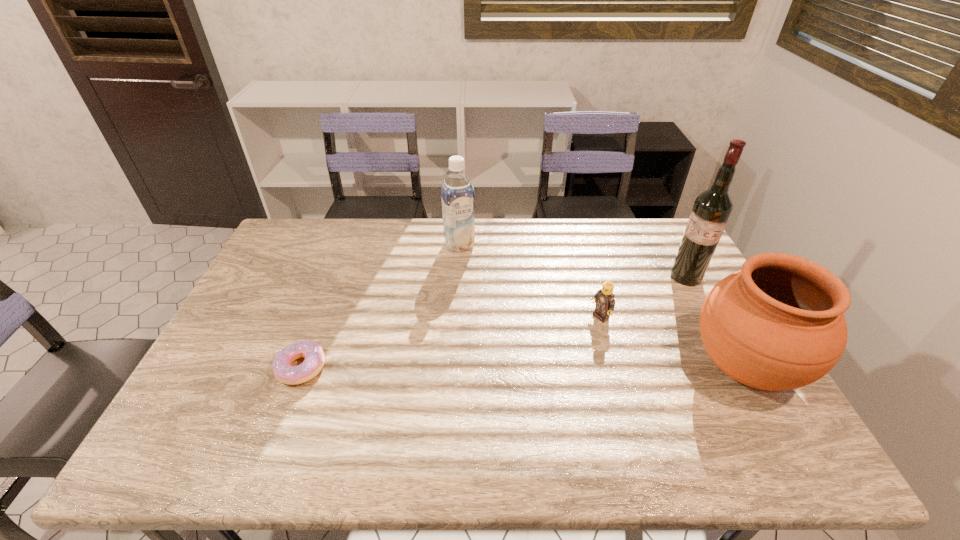
Locate which object ranks in proximity to the soya milk. Please provide its 2D coordinates. Your answer should be formatted as a tuple, i.e. [(x, y)], where the tuple contains the x and y coordinates of a point satisfying the conditions above.

[(604, 298)]

What are the coordinates of `blank space that satisfies the following two spatial constraints: 1. on the front side of the Lego; 2. on the left side of the farthest object` in the screenshot? It's located at (455, 318).

You are a GUI agent. You are given a task and a screenshot of the screen. Output one action in this format:
    pyautogui.click(x=<x>, y=<y>)
    Task: Click on the vacant position in the image that satisfies the following two spatial constraints: 1. on the front side of the second farthest object; 2. on the left side of the second object from left to right
    
    Given the screenshot: What is the action you would take?
    pyautogui.click(x=458, y=277)

Locate an element on the screen. The width and height of the screenshot is (960, 540). vacant region that satisfies the following two spatial constraints: 1. on the front side of the farthest object; 2. on the left side of the fourth tallest object is located at coordinates (455, 318).